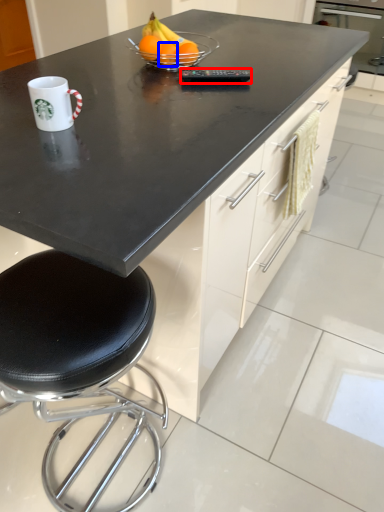
Question: Which of the following is the farthest to the observer, appliance (highlighted by a red box) or orange (highlighted by a blue box)?

Choices:
 (A) appliance
 (B) orange

Answer: (B)